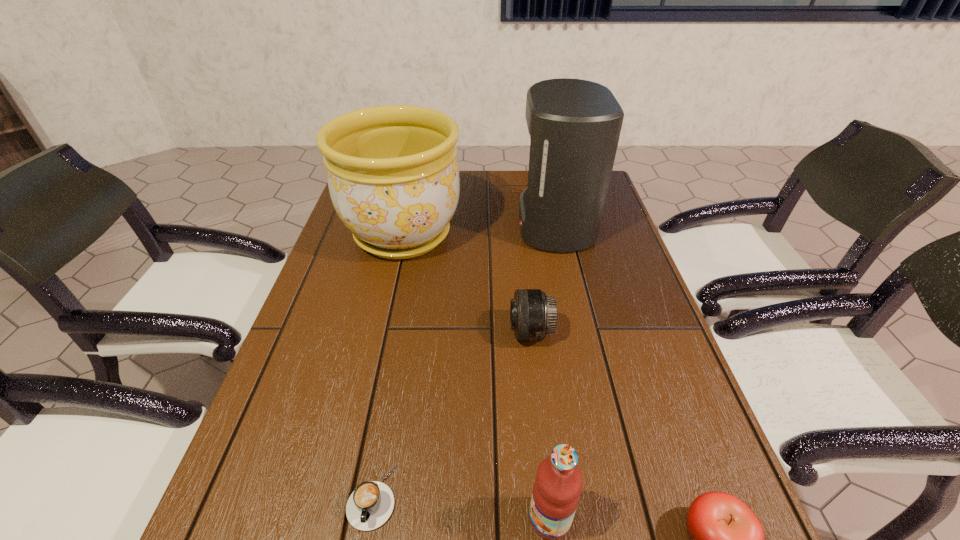
Find the location of a particular element. coffee maker is located at coordinates (574, 125).

Locate an element on the screen. The height and width of the screenshot is (540, 960). flowerpot is located at coordinates (393, 176).

Where is `telephoto lens`? This screenshot has width=960, height=540. telephoto lens is located at coordinates (533, 314).

At what (x,y) coordinates should I click in order to perform the action: click on the shortest object. Please return your answer as a coordinate pair (x, y). The height and width of the screenshot is (540, 960). Looking at the image, I should click on (370, 505).

The height and width of the screenshot is (540, 960). I want to click on free space located on the button side of the coffee maker, so click(x=485, y=225).

The image size is (960, 540). In order to click on free space located on the button side of the coffee maker in this screenshot , I will do `click(413, 225)`.

Identify the location of vacant space located on the button side of the coffee maker. (422, 225).

Identify the location of free location located 0.380m on the front of the second tallest object. click(367, 395).

Locate an element on the screen. The width and height of the screenshot is (960, 540). vacant area situated 0.360m on the front-facing side of the third farthest object is located at coordinates (354, 332).

I want to click on free space located 0.100m on the front-facing side of the third farthest object, so click(467, 332).